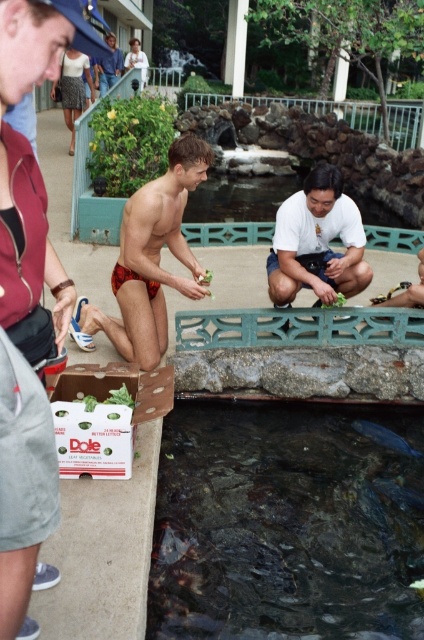
Question: Is transparent glass fish pond at lower center to the right of white cardboard box at lower center from the viewer's perspective?

Choices:
 (A) yes
 (B) no

Answer: (A)

Question: Which object is farther from the camera taking this photo?

Choices:
 (A) white matte shirt at center
 (B) reddish-brown fabric shorts at center
 (C) transparent glass fish pond at lower center

Answer: (A)

Question: Where is transparent glass fish pond at lower center located in relation to white cardboard box at lower center in the image?

Choices:
 (A) left
 (B) right

Answer: (B)

Question: Based on their relative distances, which object is nearer to the white cardboard box at lower center?

Choices:
 (A) reddish-brown fabric shorts at center
 (B) transparent glass fish pond at lower center
 (C) shiny dark blue fish at lower center

Answer: (B)

Question: Among these points, which one is nearest to the camera?

Choices:
 (A) (92, 456)
 (B) (382, 435)
 (C) (114, 77)
 (D) (242, 508)

Answer: (A)

Question: Can you confirm if reddish-brown fabric shorts at center is positioned below shiny dark blue fish at lower center?

Choices:
 (A) no
 (B) yes

Answer: (A)